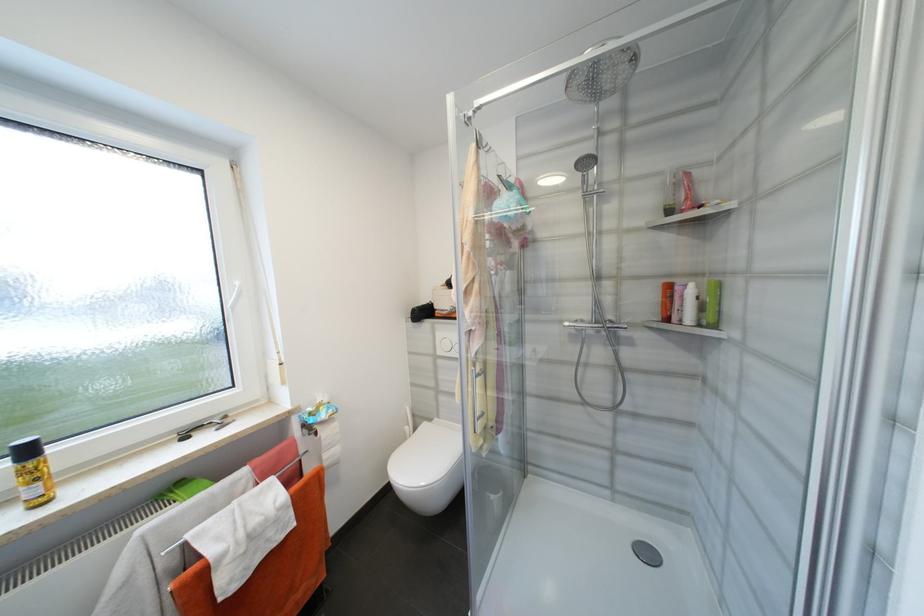
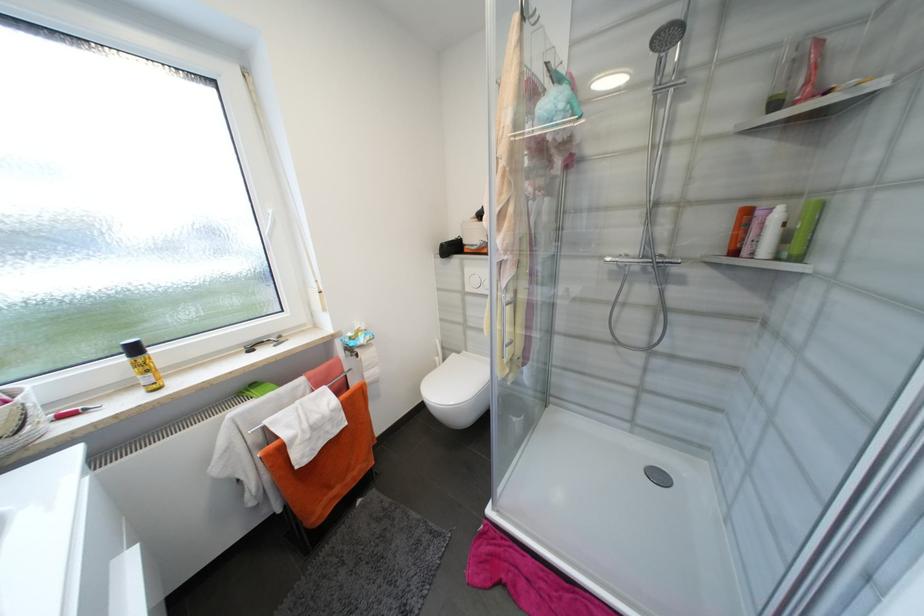
Which direction would the cameraman need to move to produce the second image?

The cameraman walked toward left, forward.